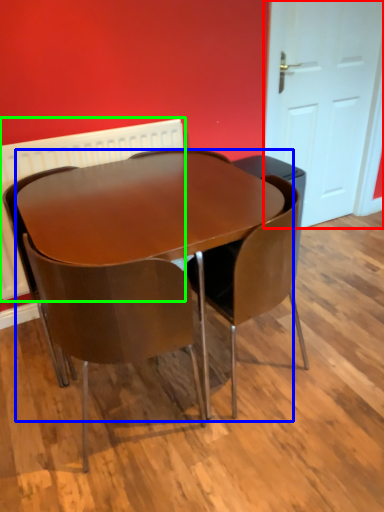
Question: Estimate the real-world distances between objects in this image. Which object is farther from door (highlighted by a red box), table (highlighted by a blue box) or radiator (highlighted by a green box)?

Choices:
 (A) table
 (B) radiator

Answer: (A)